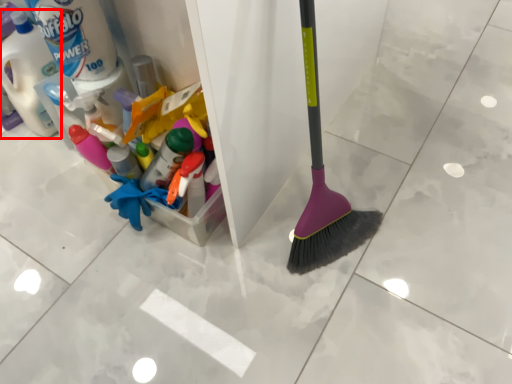
Question: From the image's perspective, considering the relative positions of bottle (annotated by the red box) and cleaning product in the image provided, where is bottle (annotated by the red box) located with respect to the staircase?

Choices:
 (A) below
 (B) above

Answer: (A)